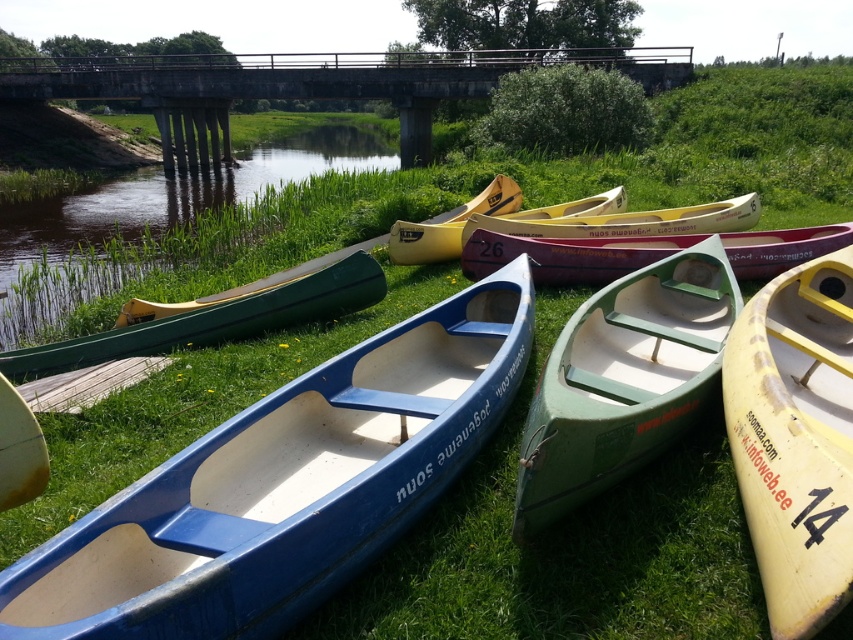
Is point (149, 109) closer to camera compared to point (494, 177)?

That is False.

Does point (431, 84) come farther from viewer compared to point (450, 230)?

That is True.

Does point (219, 58) come in front of point (508, 180)?

No, (219, 58) is further to viewer.

At what (x,y) coordinates should I click in order to perform the action: click on concrete bridge at upper center. Please return your answer as a coordinate pair (x, y). This screenshot has width=853, height=640. Looking at the image, I should click on (316, 83).

Does blue plastic canoe at center have a lesser height compared to yellow matte canoe at center?

In fact, blue plastic canoe at center may be taller than yellow matte canoe at center.

Does blue plastic canoe at center appear under yellow matte canoe at center?

Yes.

Which is behind, point (349, 461) or point (583, 214)?

The point (583, 214) is behind.

You are a GUI agent. You are given a task and a screenshot of the screen. Output one action in this format:
    pyautogui.click(x=<x>, y=<y>)
    Task: Click on the blue plastic canoe at center
    
    Given the screenshot: What is the action you would take?
    pyautogui.click(x=285, y=486)

Is yellow matte canoe at lower right thinner than green matte canoe at left?

Indeed, yellow matte canoe at lower right has a lesser width compared to green matte canoe at left.

Which is in front, point (780, 552) or point (334, 316)?

Point (780, 552) is in front.

Image resolution: width=853 pixels, height=640 pixels. Identify the location of yellow matte canoe at lower right. (795, 438).